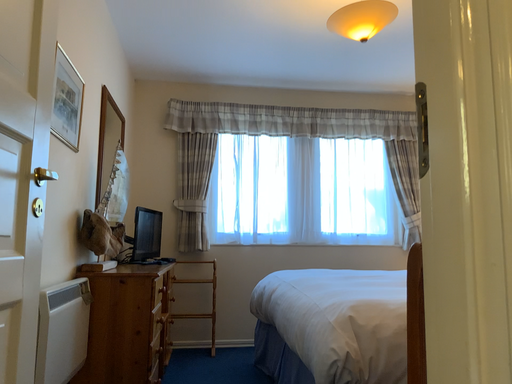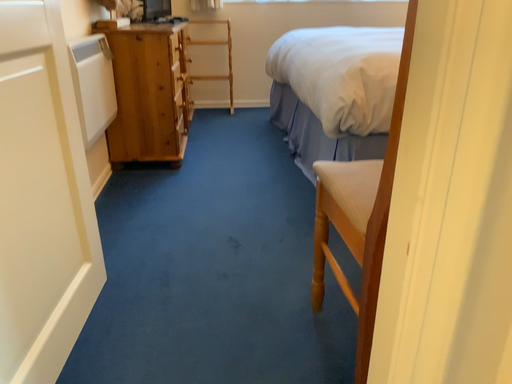
Question: How did the camera likely rotate when shooting the video?

Choices:
 (A) rotated upward
 (B) rotated downward

Answer: (B)